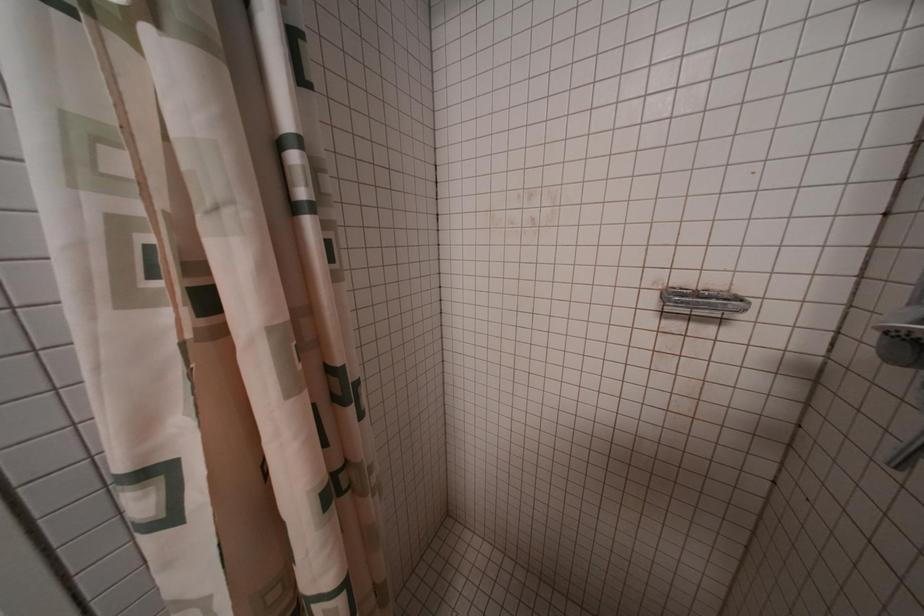
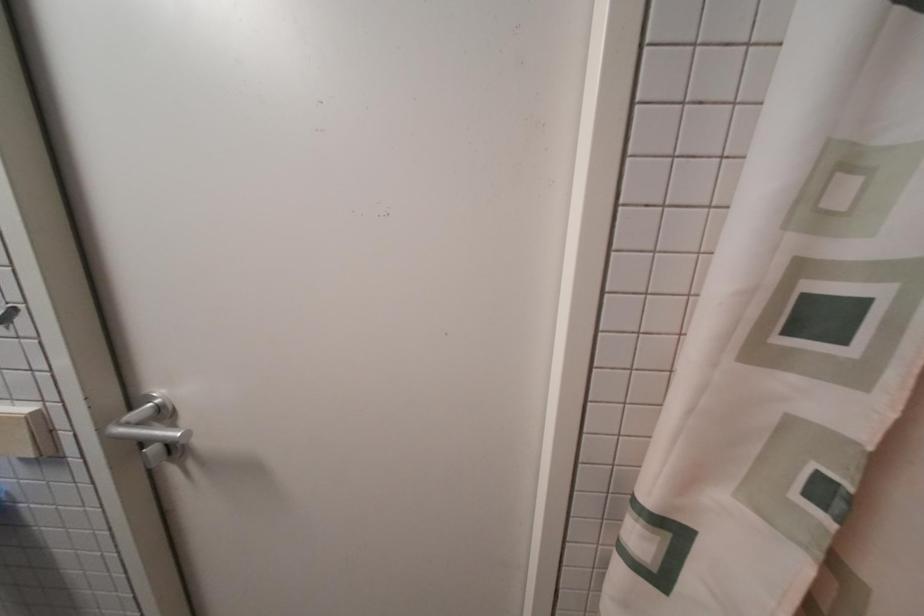
Question: The first image is from the beginning of the video and the second image is from the end. How did the camera likely rotate when shooting the video?

Choices:
 (A) Left
 (B) Right
 (C) Up
 (D) Down

Answer: (A)